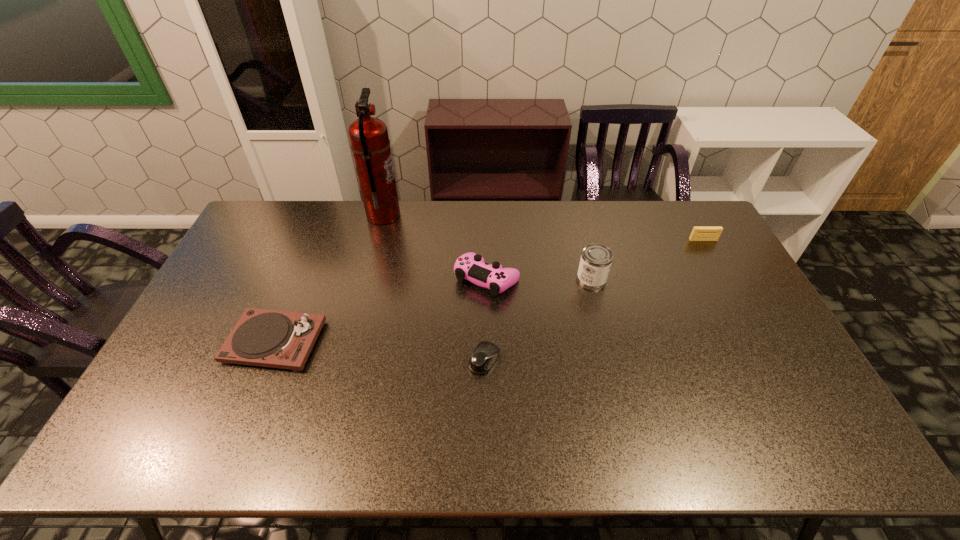
At what (x,y) coordinates should I click in order to perform the action: click on the tallest object. Please return your answer as a coordinate pair (x, y). Looking at the image, I should click on (369, 141).

Image resolution: width=960 pixels, height=540 pixels. In order to click on the second object from left to right in this screenshot , I will do point(369,141).

You are a GUI agent. You are given a task and a screenshot of the screen. Output one action in this format:
    pyautogui.click(x=<x>, y=<y>)
    Task: Click on the can
    
    Given the screenshot: What is the action you would take?
    pyautogui.click(x=596, y=259)

Find the location of `the fifth object from left to right`. the fifth object from left to right is located at coordinates (596, 259).

The height and width of the screenshot is (540, 960). Find the location of `the fourth shortest object`. the fourth shortest object is located at coordinates (470, 266).

Where is `the fifth nearest object`? This screenshot has height=540, width=960. the fifth nearest object is located at coordinates (699, 233).

Identify the location of videotape. (699, 233).

Image resolution: width=960 pixels, height=540 pixels. In order to click on phonograph_record in this screenshot , I will do `click(267, 338)`.

What are the coordinates of `the shortest object` in the screenshot? It's located at (486, 353).

You are a GUI agent. You are given a task and a screenshot of the screen. Output one action in this format:
    pyautogui.click(x=<x>, y=<y>)
    Task: Click on the free point located on the nozzle side of the farthest object
    The width and height of the screenshot is (960, 540).
    Given the screenshot: What is the action you would take?
    pyautogui.click(x=445, y=215)